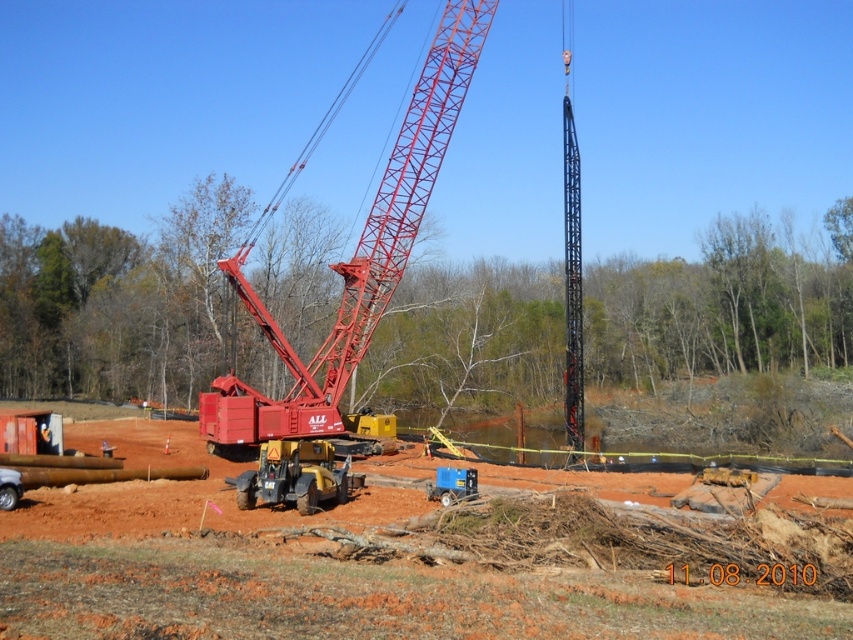
Question: Does metallic red crane at center have a greater width compared to yellow rubber tractor at center?

Choices:
 (A) yes
 (B) no

Answer: (A)

Question: Which is nearer to the metallic red crane at center?

Choices:
 (A) matte yellow excavator at center
 (B) yellow rubber tractor at center

Answer: (A)

Question: Is matte yellow excavator at center wider than yellow rubber tractor at center?

Choices:
 (A) yes
 (B) no

Answer: (A)

Question: Which is nearer to the matte yellow excavator at center?

Choices:
 (A) metallic red crane at center
 (B) yellow rubber tractor at center

Answer: (B)

Question: Which point is farther to the camera?

Choices:
 (A) (289, 472)
 (B) (62, 547)

Answer: (A)

Question: From the image, what is the correct spatial relationship of matte yellow excavator at center in relation to yellow rubber tractor at center?

Choices:
 (A) left
 (B) right

Answer: (B)